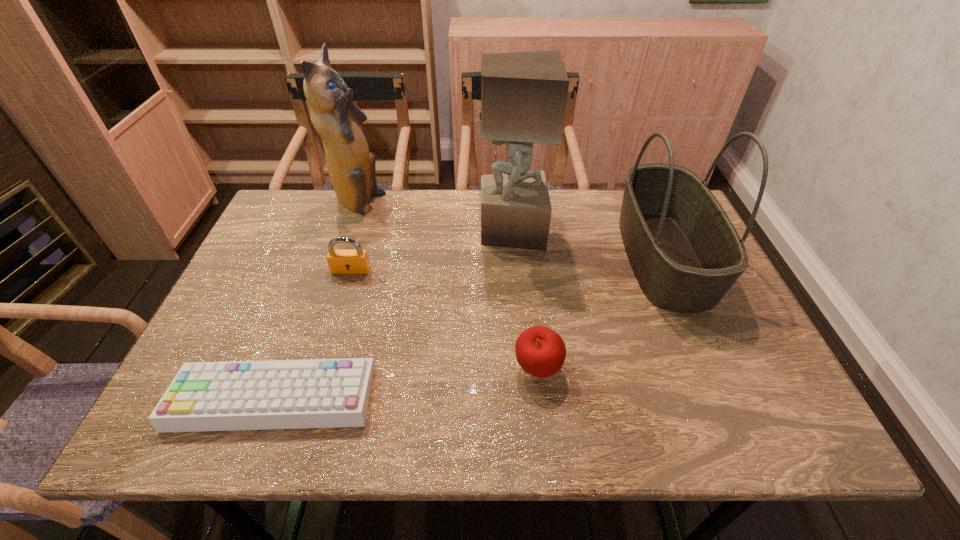
I want to click on object at the right edge, so click(x=686, y=254).

Identify the location of object at the near left corner. (315, 393).

Where is `object present at the far right corner`? The height and width of the screenshot is (540, 960). object present at the far right corner is located at coordinates (686, 254).

Identify the location of blank space at the far edge. The width and height of the screenshot is (960, 540). (586, 231).

At what (x,y) coordinates should I click in order to perform the action: click on vacant space at the near edge of the desktop. Please return your answer as a coordinate pair (x, y). Looking at the image, I should click on coord(558,414).

Identify the location of vacant space at the left edge of the desktop. (255, 330).

Where is `free space at the far left corner of the desktop`? This screenshot has height=540, width=960. free space at the far left corner of the desktop is located at coordinates (299, 220).

Locate an element on the screen. This screenshot has width=960, height=540. unoccupied position between the apple and the rightmost object is located at coordinates (601, 313).

Locate an element on the screen. This screenshot has width=960, height=540. free space that is in between the sculpture and the apple is located at coordinates (524, 300).

You are a GUI agent. You are given a task and a screenshot of the screen. Output one action in this format:
    pyautogui.click(x=<x>, y=<y>)
    Task: Click on the vacant region between the apple and the third tallest object
    The width and height of the screenshot is (960, 540).
    Given the screenshot: What is the action you would take?
    pyautogui.click(x=601, y=313)